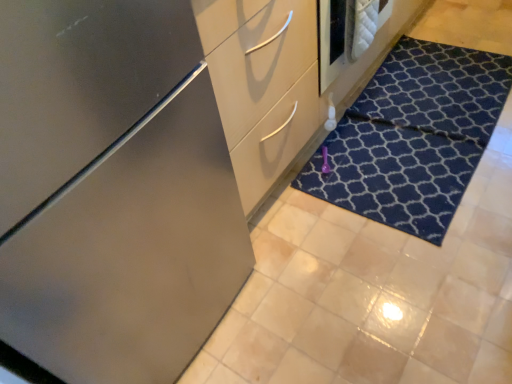
Where is `satin finish cabinet at center`? satin finish cabinet at center is located at coordinates (133, 255).

Is satin finish cabinet at center at the left side of dark blue textured doormat at lower right?

Indeed, satin finish cabinet at center is positioned on the left side of dark blue textured doormat at lower right.

Does satin finish cabinet at center have a larger size compared to dark blue textured doormat at lower right?

Yes, satin finish cabinet at center is bigger than dark blue textured doormat at lower right.

Is satin finish cabinet at center inside the boundaries of dark blue textured doormat at lower right, or outside?

satin finish cabinet at center is not enclosed by dark blue textured doormat at lower right.

Is satin finish cabinet at center next to dark blue textured doormat at lower right and touching it?

No, satin finish cabinet at center is not beside dark blue textured doormat at lower right.

Image resolution: width=512 pixels, height=384 pixels. What are the coordinates of `doormat on the right of satin finish dresser at center` in the screenshot? It's located at (413, 137).

Can you confirm if dark blue textured doormat at lower right is positioned to the left of satin finish dresser at center?

Incorrect, dark blue textured doormat at lower right is not on the left side of satin finish dresser at center.

Is satin finish dresser at center a part of dark blue textured doormat at lower right?

No.

From the image's perspective, between dark blue textured doormat at lower right and satin finish dresser at center, which one is located above?

satin finish dresser at center appears higher in the image.

Is satin finish cabinet at center in front of or behind satin finish dresser at center in the image?

satin finish cabinet at center is positioned closer to the viewer than satin finish dresser at center.

How far apart are satin finish cabinet at center and satin finish dresser at center?

satin finish cabinet at center is 15.88 inches from satin finish dresser at center.

Does point (19, 331) appear closer or farther from the camera than point (225, 2)?

Point (19, 331) is positioned closer to the camera compared to point (225, 2).

Is satin finish cabinet at center positioned beyond the bounds of satin finish dresser at center?

Absolutely, satin finish cabinet at center is external to satin finish dresser at center.

Can you tell me how much satin finish dresser at center and dark blue textured doormat at lower right differ in facing direction?

The angle between the facing direction of satin finish dresser at center and the facing direction of dark blue textured doormat at lower right is 2.37 degrees.

Who is bigger, satin finish dresser at center or dark blue textured doormat at lower right?

With larger size is satin finish dresser at center.

Is satin finish dresser at center positioned beyond the bounds of dark blue textured doormat at lower right?

Yes, satin finish dresser at center is located beyond the bounds of dark blue textured doormat at lower right.

From a real-world perspective, is satin finish dresser at center physically above dark blue textured doormat at lower right?

Yes, from a real-world perspective, satin finish dresser at center is above dark blue textured doormat at lower right.

From a real-world perspective, between dark blue textured doormat at lower right and satin finish cabinet at center, who is vertically lower?

dark blue textured doormat at lower right.

Which is in front, point (473, 170) or point (245, 241)?

The point (245, 241) is more forward.

Does dark blue textured doormat at lower right have a smaller size compared to satin finish cabinet at center?

Correct, dark blue textured doormat at lower right occupies less space than satin finish cabinet at center.

Who is shorter, dark blue textured doormat at lower right or satin finish cabinet at center?

With less height is dark blue textured doormat at lower right.

Does point (344, 90) appear closer or farther from the camera than point (243, 278)?

Point (344, 90) is positioned farther from the camera compared to point (243, 278).

In terms of width, does satin finish dresser at center look wider or thinner when compared to satin finish cabinet at center?

Considering their sizes, satin finish dresser at center looks slimmer than satin finish cabinet at center.

In terms of size, does satin finish dresser at center appear bigger or smaller than satin finish cabinet at center?

satin finish dresser at center is bigger than satin finish cabinet at center.

This screenshot has height=384, width=512. I want to click on doormat behind the satin finish cabinet at center, so click(x=413, y=137).

Find the location of a particular element. The height and width of the screenshot is (384, 512). dresser in front of the dark blue textured doormat at lower right is located at coordinates (281, 81).

Based on their spatial positions, is satin finish cabinet at center or satin finish dresser at center closer to dark blue textured doormat at lower right?

satin finish dresser at center is closer to dark blue textured doormat at lower right.

Considering their positions, is satin finish dresser at center positioned closer to dark blue textured doormat at lower right than satin finish cabinet at center?

satin finish dresser at center is closer to dark blue textured doormat at lower right.

Looking at the image, which one is located closer to satin finish cabinet at center, dark blue textured doormat at lower right or satin finish dresser at center?

satin finish dresser at center lies closer to satin finish cabinet at center than the other object.

Based on the photo, which object lies further to the anchor point satin finish dresser at center, satin finish cabinet at center or dark blue textured doormat at lower right?

satin finish cabinet at center.

From the image, which object appears to be farther from satin finish dresser at center, dark blue textured doormat at lower right or satin finish cabinet at center?

Among the two, satin finish cabinet at center is located further to satin finish dresser at center.

When comparing their distances from satin finish cabinet at center, does satin finish dresser at center or dark blue textured doormat at lower right seem further?

dark blue textured doormat at lower right lies further to satin finish cabinet at center than the other object.

Locate an element on the screen. The image size is (512, 384). dresser between satin finish cabinet at center and dark blue textured doormat at lower right in the horizontal direction is located at coordinates (281, 81).